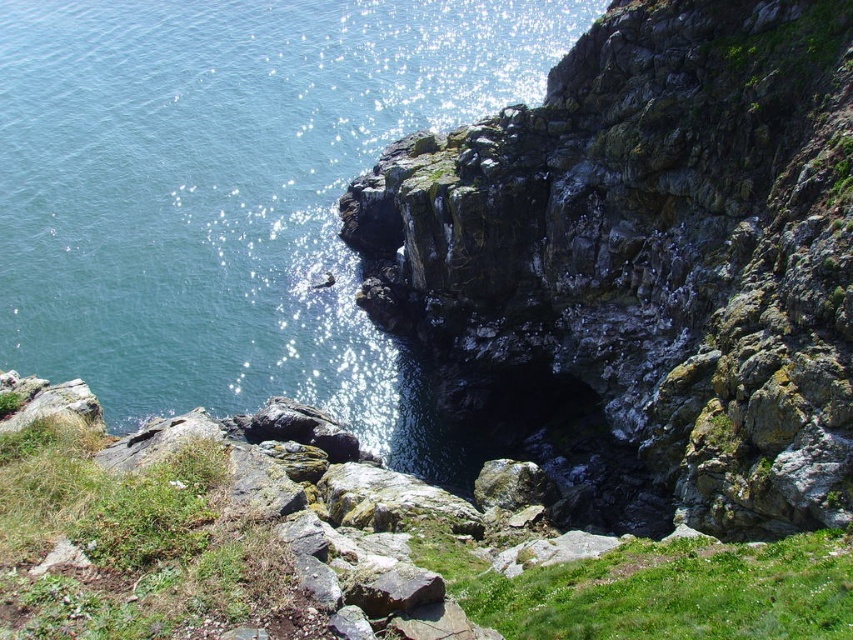
Measure the distance between point (788, 100) and camera.

151.16 feet

Looking at this image, can you confirm if rough stone cave at center is bigger than blue water at center?

Actually, rough stone cave at center might be smaller than blue water at center.

Between point (653, 227) and point (132, 352), which one is positioned in front?

Point (653, 227) is in front.

Where is `rough stone cave at center`? Image resolution: width=853 pixels, height=640 pixels. rough stone cave at center is located at coordinates (646, 262).